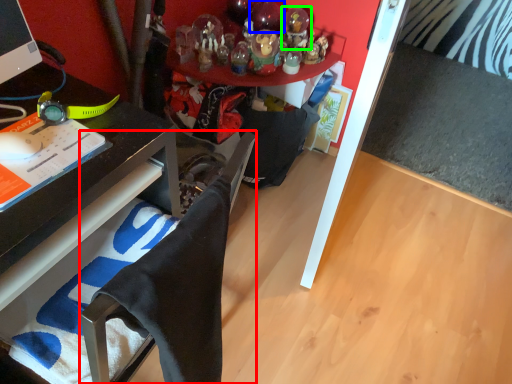
Question: Which object is the farthest from computer chair (highlighted by a red box)? Choose among these: toy (highlighted by a blue box) or toy (highlighted by a green box).

Choices:
 (A) toy
 (B) toy

Answer: (A)